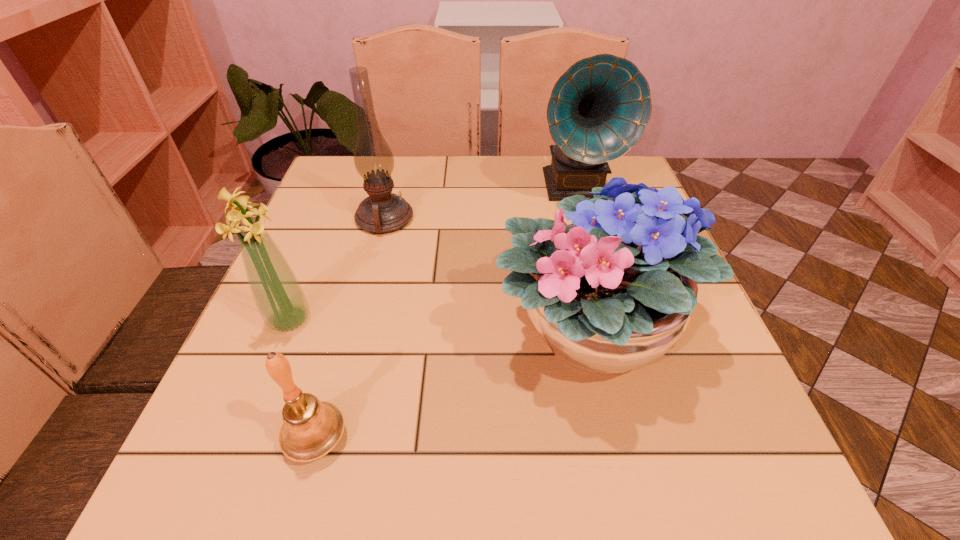
This screenshot has height=540, width=960. What are the coordinates of `free location that satisfies the following two spatial constraints: 1. on the front-facing side of the right bouquet; 2. on the left side of the left bouquet` in the screenshot? It's located at (284, 333).